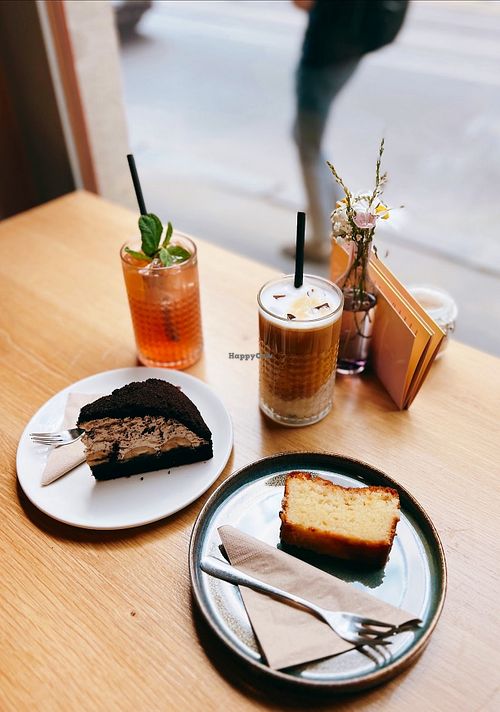
Locate an element on the screen. Image resolution: width=500 pixels, height=712 pixels. plate is located at coordinates (421, 570).